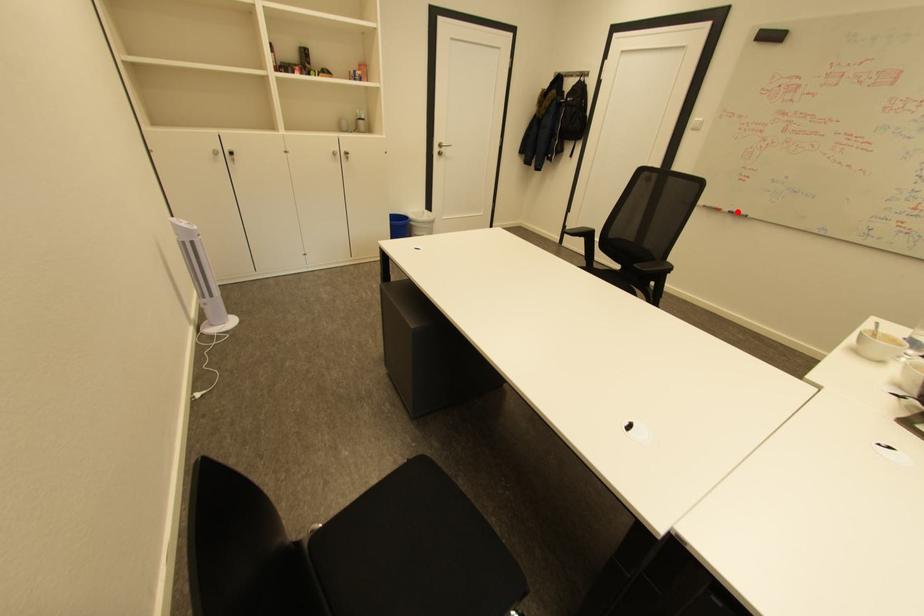
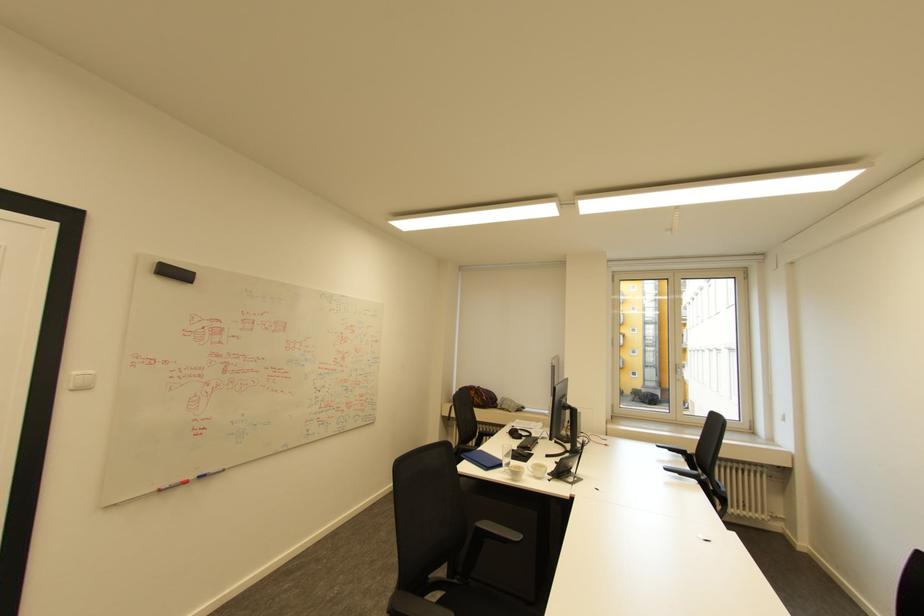
Locate, in the second image, the point that corresponds to the highlighted location in the first image.

(207, 477)